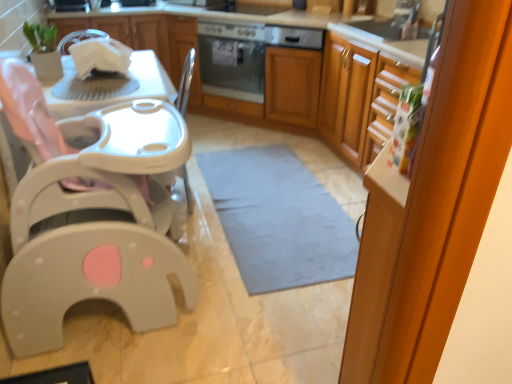
This screenshot has height=384, width=512. In order to click on free space above gray fabric mat at center (from a real-world perspective) in this screenshot , I will do `click(274, 197)`.